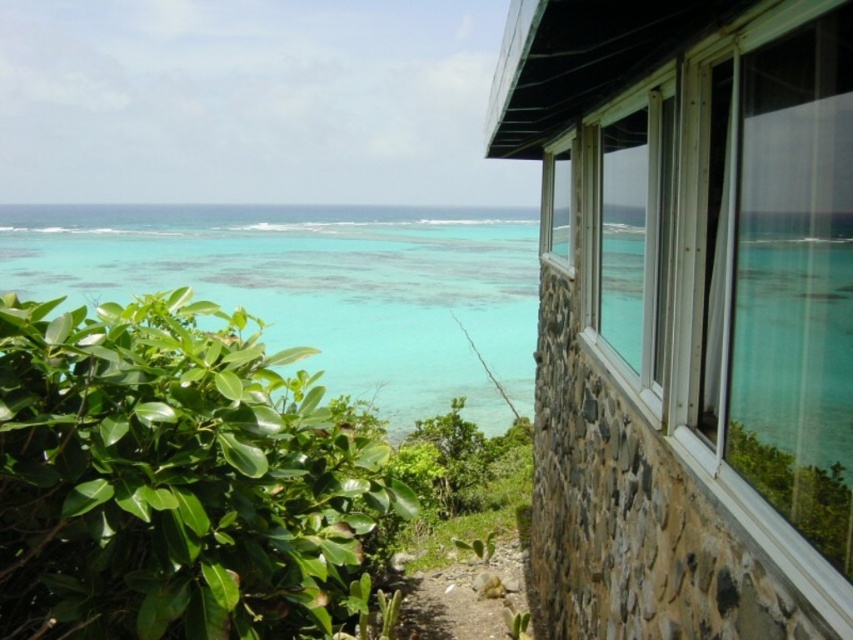
Question: Which point is farther to the camera?

Choices:
 (A) translucent water at lower left
 (B) clear glass window at upper right

Answer: (A)

Question: Does translucent water at lower left lie in front of clear glass window at upper right?

Choices:
 (A) no
 (B) yes

Answer: (A)

Question: Does green spiky cactus at lower center appear on the left side of clear glass window at upper right?

Choices:
 (A) no
 (B) yes

Answer: (B)

Question: Is translucent water at lower left smaller than green spiky cactus at lower center?

Choices:
 (A) no
 (B) yes

Answer: (A)

Question: Which of the following is the farthest from the observer?

Choices:
 (A) (544, 250)
 (B) (57, 228)
 (C) (426, 593)

Answer: (B)

Question: Which is farther from the translucent water at lower left?

Choices:
 (A) green spiky cactus at lower center
 (B) clear glass window at upper right

Answer: (B)